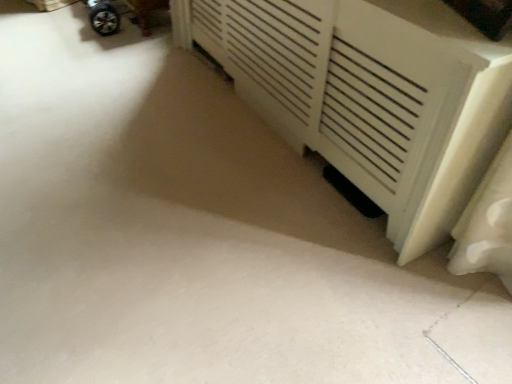
Question: Would you say white matte radiator at center is inside or outside metallic silver wheel at upper left?

Choices:
 (A) inside
 (B) outside

Answer: (B)

Question: From a real-world perspective, is white matte radiator at center above or below metallic silver wheel at upper left?

Choices:
 (A) below
 (B) above

Answer: (B)

Question: Is white matte radiator at center to the left or to the right of metallic silver wheel at upper left in the image?

Choices:
 (A) left
 (B) right

Answer: (B)

Question: From the image's perspective, is metallic silver wheel at upper left above or below white matte radiator at center?

Choices:
 (A) below
 (B) above

Answer: (B)

Question: Based on their positions, is metallic silver wheel at upper left located to the left or right of white matte radiator at center?

Choices:
 (A) right
 (B) left

Answer: (B)

Question: Considering the positions of metallic silver wheel at upper left and white matte radiator at center in the image, is metallic silver wheel at upper left wider or thinner than white matte radiator at center?

Choices:
 (A) thin
 (B) wide

Answer: (A)

Question: Would you say metallic silver wheel at upper left is inside or outside white matte radiator at center?

Choices:
 (A) outside
 (B) inside

Answer: (A)